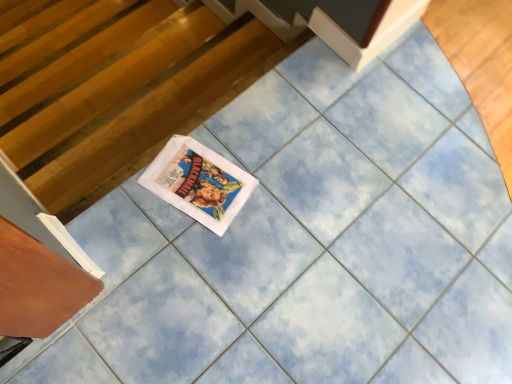
Describe the element at coordinates (198, 182) in the screenshot. I see `white paper comic book at center` at that location.

Locate an element on the screen. wooden drawer at lower left is located at coordinates (38, 285).

Is wooden at left directly adjacent to wooden drawer at lower left?

wooden at left and wooden drawer at lower left are clearly separated.

Which is further, (20, 124) or (64, 272)?

The point (20, 124) is behind.

Between wooden at left and wooden drawer at lower left, which one has smaller size?

wooden drawer at lower left is smaller.

Which object is closer to the camera, wooden at left or wooden drawer at lower left?

Positioned in front is wooden drawer at lower left.

Consider the image. Is white paper comic book at center oriented away from wooden drawer at lower left?

No, wooden drawer at lower left is not at the back of white paper comic book at center.

Which of these two, white paper comic book at center or wooden drawer at lower left, is smaller?

Smaller between the two is white paper comic book at center.

Consider the image. Considering the relative sizes of wooden at left and white paper comic book at center in the image provided, is wooden at left shorter than white paper comic book at center?

In fact, wooden at left may be taller than white paper comic book at center.

Is the position of wooden at left more distant than that of white paper comic book at center?

Yes, the depth of wooden at left is greater than that of white paper comic book at center.

How distant is wooden at left from white paper comic book at center?

18.31 inches.

Locate an element on the screen. The image size is (512, 384). stairwell that is behind the white paper comic book at center is located at coordinates (132, 101).

Considering the relative sizes of white paper comic book at center and wooden at left in the image provided, is white paper comic book at center shorter than wooden at left?

Yes.

From the image's perspective, is white paper comic book at center positioned above or below wooden at left?

Clearly, from the image's perspective, white paper comic book at center is below wooden at left.

Between white paper comic book at center and wooden at left, which one appears on the right side from the viewer's perspective?

white paper comic book at center.

Based on the photo, does white paper comic book at center have a lesser width compared to wooden at left?

Incorrect, the width of white paper comic book at center is not less than that of wooden at left.

Which is more to the right, wooden drawer at lower left or wooden at left?

From the viewer's perspective, wooden at left appears more on the right side.

From a real-world perspective, is wooden drawer at lower left above or below wooden at left?

From a real-world perspective, wooden drawer at lower left is physically above wooden at left.

Are wooden drawer at lower left and wooden at left far apart?

Actually, wooden drawer at lower left and wooden at left are a little close together.

Is wooden drawer at lower left in front of or behind wooden at left in the image?

wooden drawer at lower left is positioned closer to the viewer than wooden at left.

From a real-world perspective, which object stands above the other?

wooden drawer at lower left.

The image size is (512, 384). I want to click on drawer below the white paper comic book at center (from the image's perspective), so click(x=38, y=285).

From the image's perspective, between wooden drawer at lower left and white paper comic book at center, who is located below?

wooden drawer at lower left appears lower in the image.

Is wooden drawer at lower left further to the viewer compared to white paper comic book at center?

That is False.

You are a GUI agent. You are given a task and a screenshot of the screen. Output one action in this format:
    pyautogui.click(x=<x>, y=<y>)
    Task: Click on the stairwell on the right of wooden drawer at lower left
    The image size is (512, 384).
    Given the screenshot: What is the action you would take?
    pyautogui.click(x=132, y=101)

Locate an element on the screen. The height and width of the screenshot is (384, 512). comic book behind the wooden drawer at lower left is located at coordinates (198, 182).

Estimate the real-world distances between objects in this image. Which object is closer to wooden at left, wooden drawer at lower left or white paper comic book at center?

Based on the image, white paper comic book at center appears to be nearer to wooden at left.

When comparing their distances from white paper comic book at center, does wooden at left or wooden drawer at lower left seem further?

wooden at left is further to white paper comic book at center.

Based on their spatial positions, is wooden drawer at lower left or wooden at left further from white paper comic book at center?

Among the two, wooden at left is located further to white paper comic book at center.

Considering their positions, is white paper comic book at center positioned closer to wooden at left than wooden drawer at lower left?

white paper comic book at center is closer to wooden at left.

Based on their spatial positions, is wooden at left or white paper comic book at center closer to wooden drawer at lower left?

Based on the image, white paper comic book at center appears to be nearer to wooden drawer at lower left.

Which object lies further to the anchor point wooden drawer at lower left, white paper comic book at center or wooden at left?

Among the two, wooden at left is located further to wooden drawer at lower left.

Locate an element on the screen. comic book positioned between wooden drawer at lower left and wooden at left from near to far is located at coordinates click(x=198, y=182).